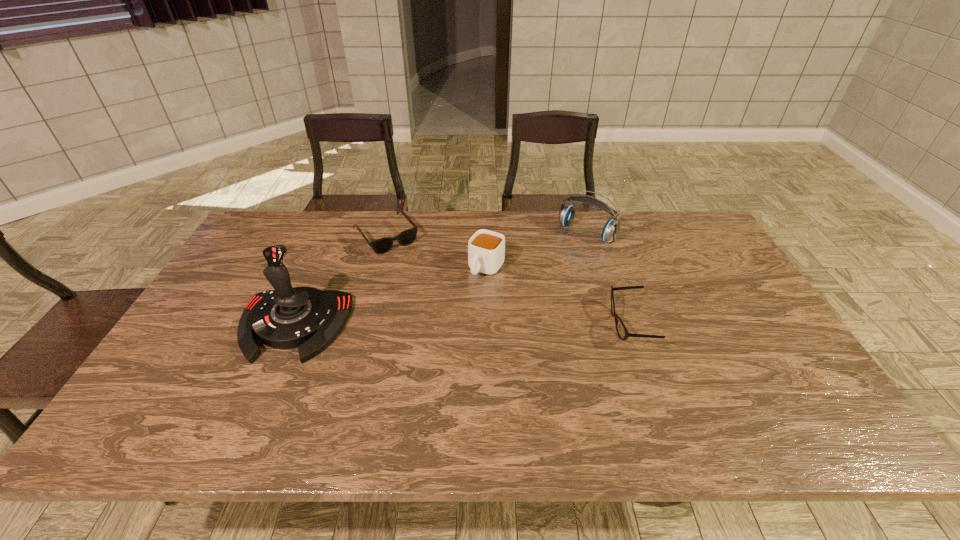
You are a GUI agent. You are given a task and a screenshot of the screen. Output one action in this format:
    pyautogui.click(x=<x>, y=<y>)
    Task: Click on the headset positioned at the far edge
    This screenshot has width=960, height=540.
    Given the screenshot: What is the action you would take?
    pyautogui.click(x=611, y=229)

Where is `object that is positioned at the left edge`? object that is positioned at the left edge is located at coordinates (308, 318).

You are a GUI agent. You are given a task and a screenshot of the screen. Output one action in this format:
    pyautogui.click(x=<x>, y=<y>)
    Task: Click on the vacant space at the far edge
    
    Given the screenshot: What is the action you would take?
    pyautogui.click(x=319, y=226)

Locate an element on the screen. This screenshot has height=540, width=960. vacant space at the near edge is located at coordinates (480, 377).

Find the location of a particular element. Image resolution: width=960 pixels, height=540 pixels. vacant region at the left edge of the desktop is located at coordinates (197, 314).

Image resolution: width=960 pixels, height=540 pixels. Find the location of `vacant region at the right edge`. vacant region at the right edge is located at coordinates (690, 268).

You are a GUI agent. You are given a task and a screenshot of the screen. Output one action in this format:
    pyautogui.click(x=<x>, y=<y>)
    Task: Click on the free space at the far left corner
    The height and width of the screenshot is (540, 960).
    Given the screenshot: What is the action you would take?
    pyautogui.click(x=287, y=232)

Locate an element on the screen. The image size is (960, 540). free space between the spectacles and the headset is located at coordinates (608, 279).

Where is `vacant region between the tallest object and the sunglasses`? This screenshot has width=960, height=540. vacant region between the tallest object and the sunglasses is located at coordinates (340, 281).

I want to click on free spot between the third object from right to left and the sunglasses, so click(436, 252).